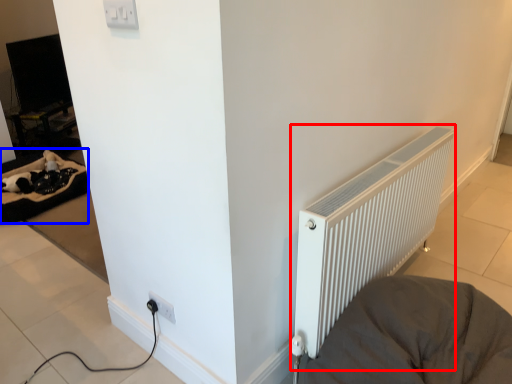
Question: Among these objects, which one is farthest to the camera, radiator (highlighted by a red box) or bedding (highlighted by a blue box)?

Choices:
 (A) radiator
 (B) bedding

Answer: (B)